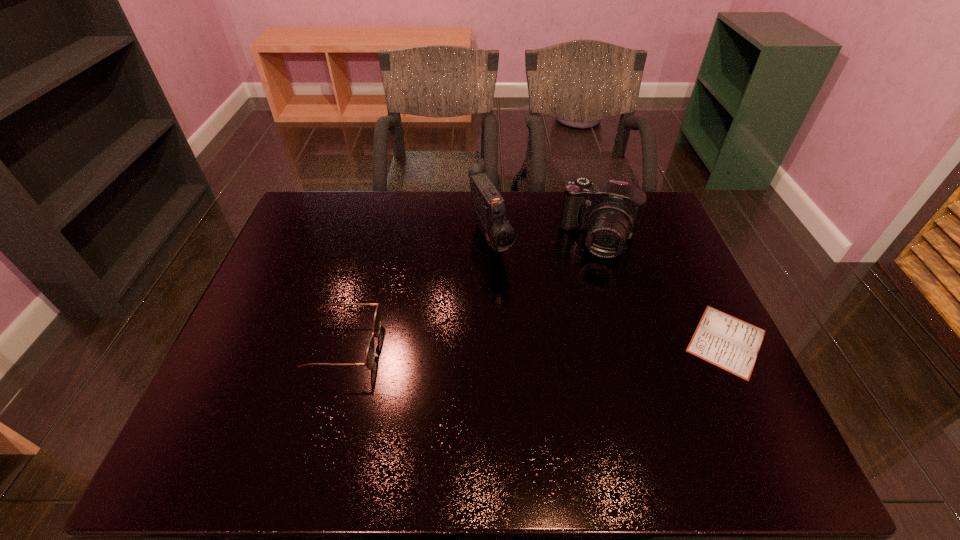
Locate an element on the screen. vacant area located 0.140m on the lens of the second object from right to left is located at coordinates pyautogui.click(x=585, y=296).

Identify the location of blank space located on the lens of the second object from right to left. Image resolution: width=960 pixels, height=540 pixels. (580, 315).

Identify the location of free space located on the lens of the second object from right to left. (584, 301).

The width and height of the screenshot is (960, 540). Identify the location of free space located on the front-facing side of the third object from right to left. (550, 372).

What are the coordinates of `vacant space situated on the front-facing side of the third object from right to left` in the screenshot? It's located at (552, 376).

This screenshot has width=960, height=540. I want to click on free space located on the front-facing side of the third object from right to left, so click(x=546, y=365).

Where is `camera at the far edge`? camera at the far edge is located at coordinates (610, 211).

The image size is (960, 540). I want to click on camcorder that is at the far edge, so click(488, 205).

Find the location of a particular element. diary that is at the right edge is located at coordinates (729, 343).

Where is `camera at the right edge`? The width and height of the screenshot is (960, 540). camera at the right edge is located at coordinates (610, 211).